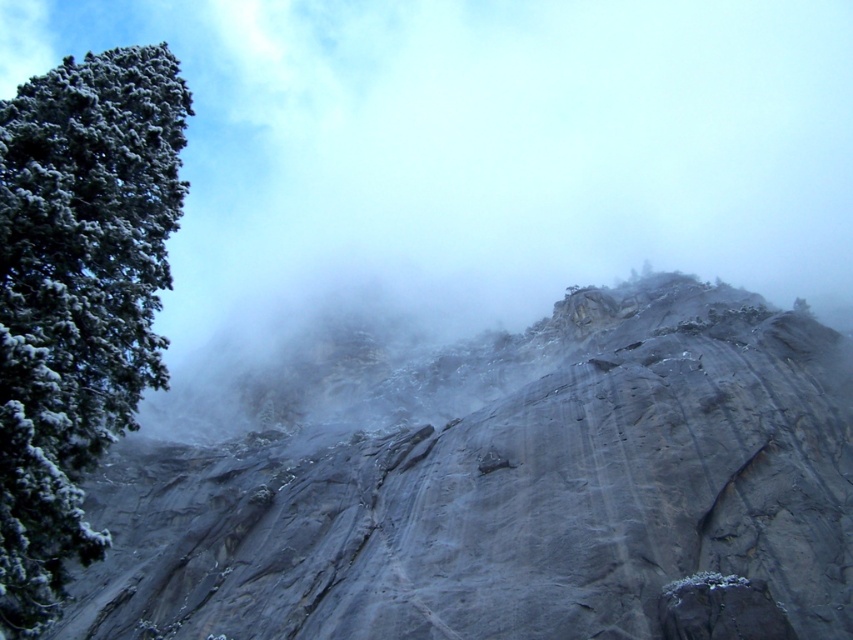
You are a hiker planning to take a photo of the gray rough rock at center. You have a camera with a focal length of 50mm. According to the rule of thumb, the minimum distance to capture the entire rock in the frame is 40 meters. Can you take the photo from your current position?

The gray rough rock at center is 38.59 meters away from the viewer. Since the minimum required distance is 40 meters, you are too close to capture the entire rock in the frame. Move back a few meters to ensure the entire rock fits in the photo.

You are planning to place a small weather station on the gray rough rock at center or the green textured tree at left. Since the weather station requires a wider surface, which object would be more suitable based on their widths?

The gray rough rock at center is wider than the green textured tree at left, so it would be more suitable for placing the weather station.

Based on the scene description, what object is located at the coordinates point [485,477]?

The gray rough rock at center is located at point [485,477].